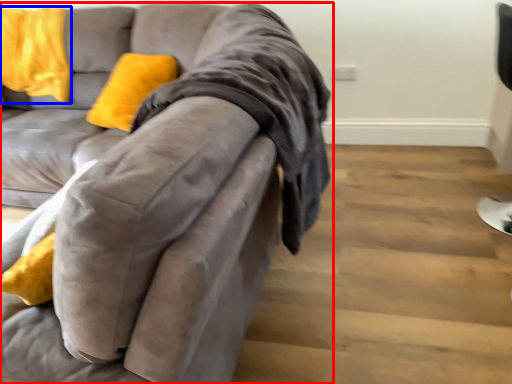
Question: Which of the following is the closest to the observer, studio couch (highlighted by a red box) or pillow (highlighted by a blue box)?

Choices:
 (A) studio couch
 (B) pillow

Answer: (A)